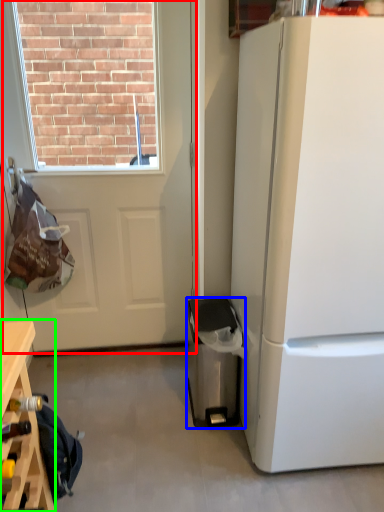
Question: Which is nearer to the door (highlighted by a red box)? trash bin/can (highlighted by a blue box) or table (highlighted by a green box).

Choices:
 (A) trash bin/can
 (B) table

Answer: (A)